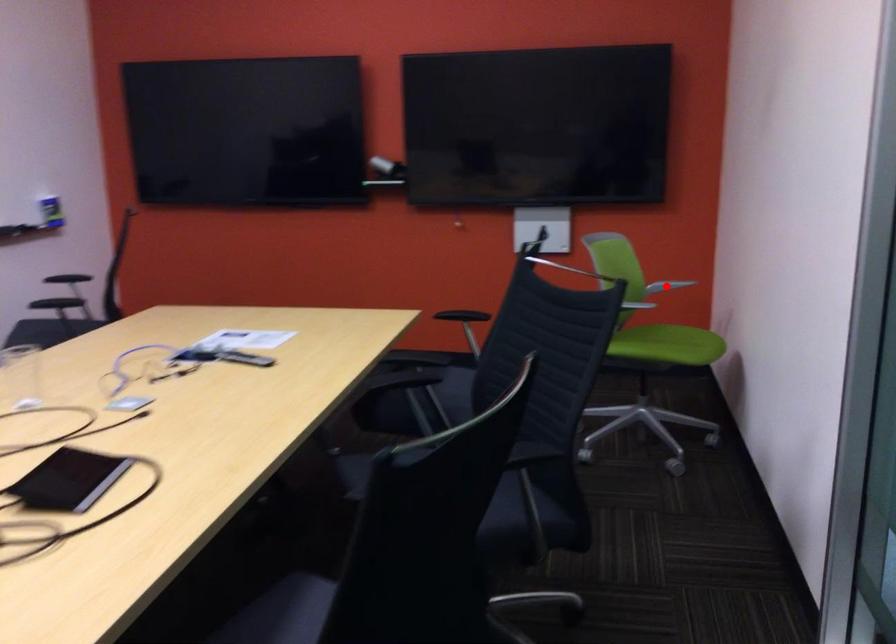
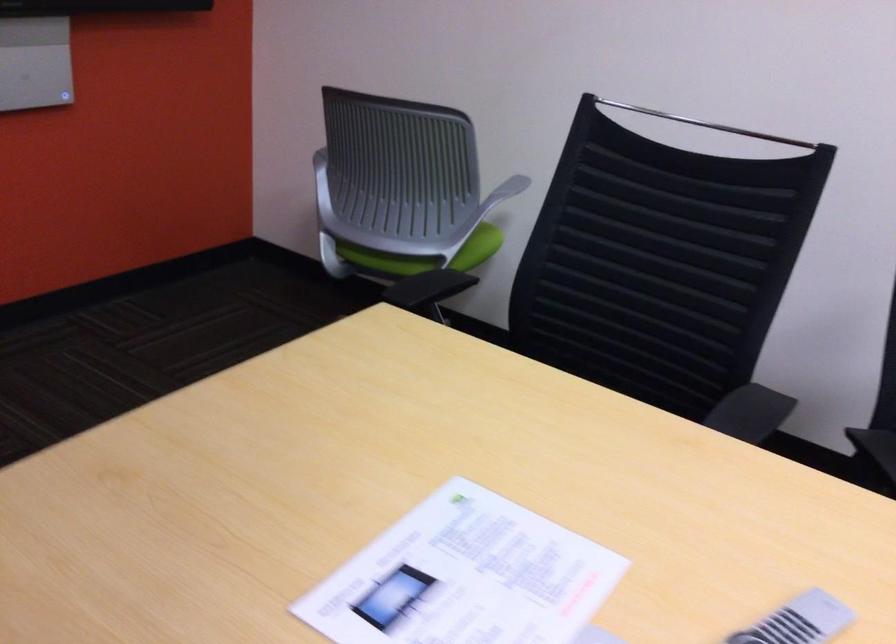
Question: I am providing you with two images of the same scene from different viewpoints. A red point is marked on the first image. At the location where the point appears in image 1, is it still visible in image 2?

Choices:
 (A) Yes
 (B) No

Answer: (B)